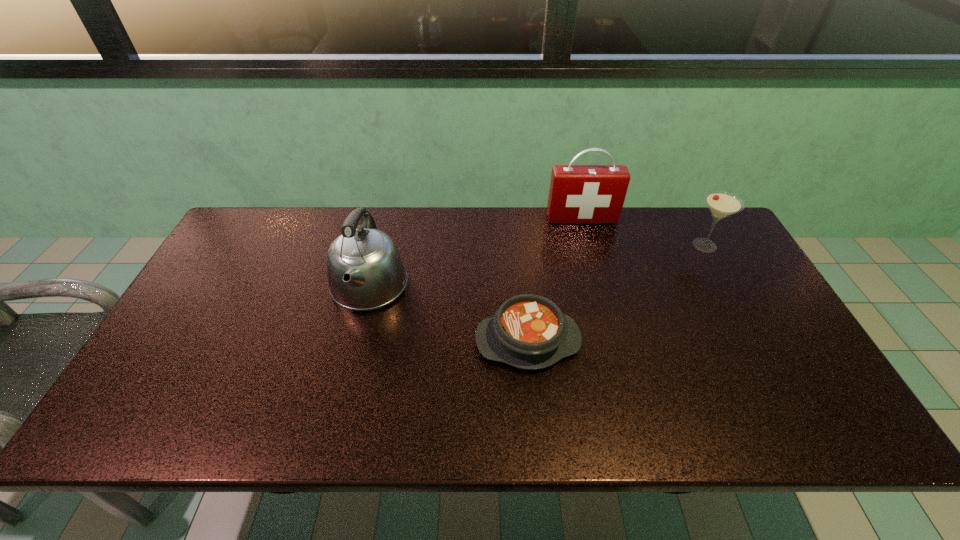
At what (x,y) coordinates should I click in order to perform the action: click on the first-aid kit. Please return your answer as a coordinate pair (x, y). This screenshot has height=540, width=960. Looking at the image, I should click on (579, 194).

The image size is (960, 540). I want to click on kettle, so click(365, 271).

Identify the location of the third tallest object. The height and width of the screenshot is (540, 960). (721, 204).

Where is `the rightmost object`? the rightmost object is located at coordinates (721, 204).

You are a GUI agent. You are given a task and a screenshot of the screen. Output one action in this format:
    pyautogui.click(x=<x>, y=<y>)
    Task: Click on the casserole
    
    Given the screenshot: What is the action you would take?
    pyautogui.click(x=528, y=331)

Find the location of `free space located on the front face of the first-aid kit`. free space located on the front face of the first-aid kit is located at coordinates (597, 279).

Find the location of a particular element. vacant point located 0.300m on the spout of the kettle is located at coordinates (332, 434).

You are a GUI agent. You are given a task and a screenshot of the screen. Output one action in this format:
    pyautogui.click(x=<x>, y=<y>)
    Task: Click on the free space located 0.100m on the back of the rightmost object
    Image resolution: width=960 pixels, height=540 pixels.
    Given the screenshot: What is the action you would take?
    pyautogui.click(x=688, y=215)

In order to click on vacant area situated on the right of the casserole in this screenshot , I will do `click(725, 341)`.

You are a GUI agent. You are given a task and a screenshot of the screen. Output one action in this format:
    pyautogui.click(x=<x>, y=<y>)
    Task: Click on the first-aid kit that is at the far edge
    
    Given the screenshot: What is the action you would take?
    pyautogui.click(x=579, y=194)